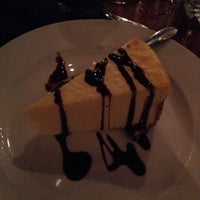
This screenshot has width=200, height=200. What are the coordinates of `wood table` in the screenshot? It's located at (125, 10).